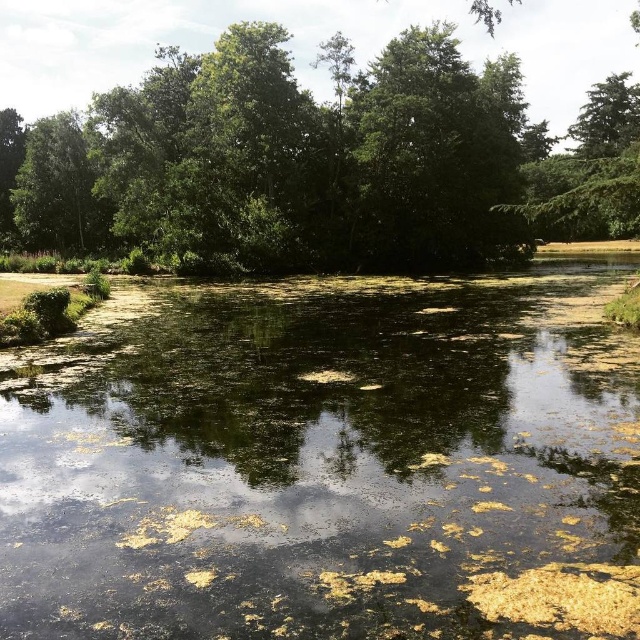
You are standing at the camera position and want to walk towards the green leafy tree at center. How far will you have to walk to reach it?

The green leafy tree at center is 21.48 meters away from the camera, so you will have to walk 21.48 meters to reach it.

You are standing in the forest looking at the green leafy tree at center and the green leafy tree at left. Which tree is closer to you?

The green leafy tree at center is closer to you because it is positioned in front of the green leafy tree at left.

Based on the photo, you are standing at the point closer to the camera in the image. Which point are you at, point (568,358) or point (492,157)?

You are at point (568,358) because it is closer to the camera than point (492,157).